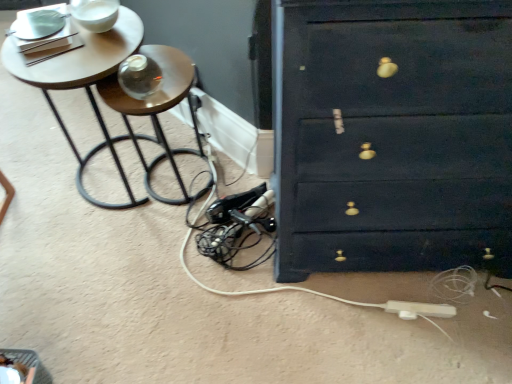
Question: Looking at their shapes, would you say wooden side table at left is wider or thinner than white plastic extension cord at lower right?

Choices:
 (A) thin
 (B) wide

Answer: (B)

Question: Does point (144, 82) appear closer or farther from the camera than point (404, 302)?

Choices:
 (A) farther
 (B) closer

Answer: (B)

Question: Which is farther from the white plastic extension cord at lower right?

Choices:
 (A) wooden round table at upper left
 (B) wooden side table at left
 (C) matte dark blue chest of drawers at right

Answer: (A)

Question: Estimate the real-world distances between objects in this image. Which object is closer to the wooden side table at left?

Choices:
 (A) wooden round table at upper left
 (B) matte dark blue chest of drawers at right
 (C) white plastic extension cord at lower right

Answer: (A)